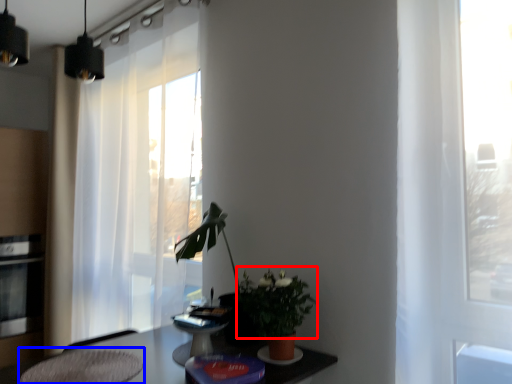
Question: Among these objects, which one is nearest to the camera, floral arrangement (highlighted by a red box) or swivel chair (highlighted by a blue box)?

Choices:
 (A) floral arrangement
 (B) swivel chair

Answer: (B)